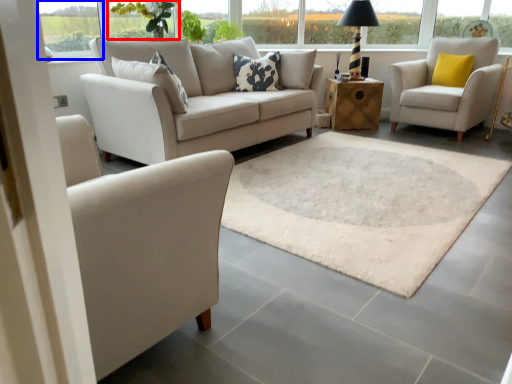
Question: Which of the following is the closest to the observer, flower (highlighted by a red box) or window (highlighted by a blue box)?

Choices:
 (A) flower
 (B) window

Answer: (B)